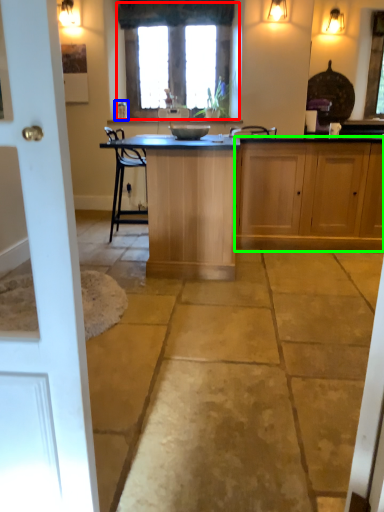
Question: Estimate the real-world distances between objects in this image. Which object is farther from window (highlighted by a red box), faucet (highlighted by a blue box) or cabinetry (highlighted by a green box)?

Choices:
 (A) faucet
 (B) cabinetry

Answer: (B)